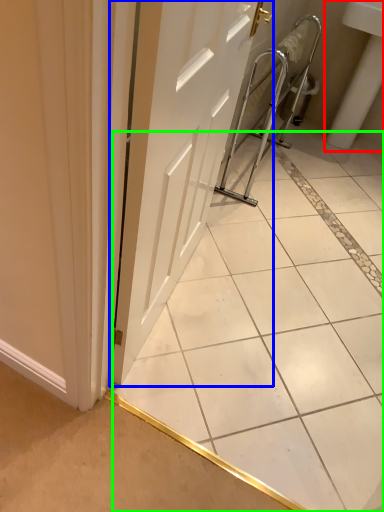
Question: Considering the real-world distances, which object is farthest from sink (highlighted by a red box)? door (highlighted by a blue box) or ceramic tile (highlighted by a green box)?

Choices:
 (A) door
 (B) ceramic tile

Answer: (A)